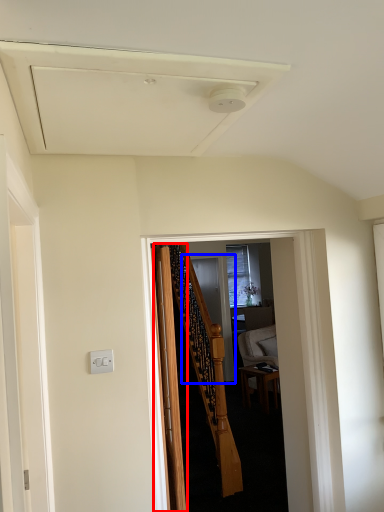
Question: Which object appears closest to the camera in this image, door (highlighted by a red box) or screen door (highlighted by a blue box)?

Choices:
 (A) door
 (B) screen door

Answer: (A)